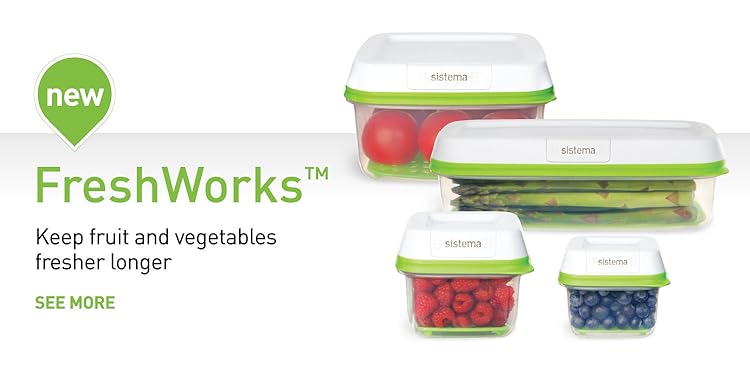
At what (x,y) coordinates should I click in order to perform the action: click on white container cover. Please return your answer as a coordinate pair (x, y). This screenshot has width=750, height=375. Looking at the image, I should click on (382, 71), (486, 130), (440, 228).